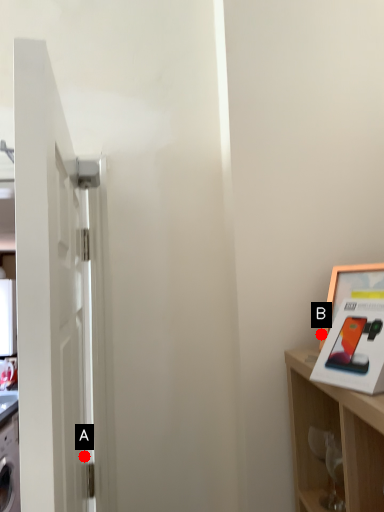
Question: Two points are circled on the image, labeled by A and B beside each circle. Which point is farther from the camera taking this photo?

Choices:
 (A) A is further
 (B) B is further

Answer: (B)